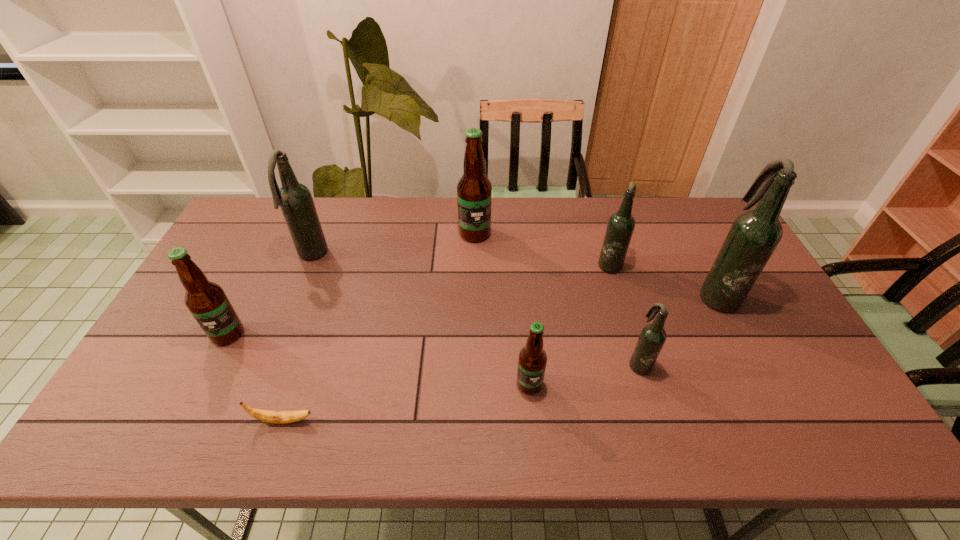
Image resolution: width=960 pixels, height=540 pixels. I want to click on free area in between the second smallest dark beer bottle and the farthest brown beer bottle, so click(x=542, y=248).

Where is `free space that is in between the biggest dark beer bottle and the third beer bottle from left to right`? The width and height of the screenshot is (960, 540). free space that is in between the biggest dark beer bottle and the third beer bottle from left to right is located at coordinates (595, 264).

Where is `free space between the third biggest dark beer bottle and the fifth object from right to left`? free space between the third biggest dark beer bottle and the fifth object from right to left is located at coordinates (542, 248).

You are a GUI agent. You are given a task and a screenshot of the screen. Output one action in this format:
    pyautogui.click(x=<x>, y=<y>)
    Task: Click on the vacant area between the nearest dark beer bottle and the banana
    The image size is (960, 540).
    Given the screenshot: What is the action you would take?
    click(461, 392)

You are a GUI agent. You are given a task and a screenshot of the screen. Output one action in this format:
    pyautogui.click(x=<x>, y=<y>)
    Task: Click on the free space between the rightmost brown beer bottle and the banana
    The image size is (960, 540).
    Given the screenshot: What is the action you would take?
    pyautogui.click(x=406, y=402)

Where is `vacant space that is in between the rightmost brown beer bottle and the third biggest dark beer bottle`? vacant space that is in between the rightmost brown beer bottle and the third biggest dark beer bottle is located at coordinates (569, 323).

This screenshot has width=960, height=540. Identify the location of free space between the rightmost brown beer bottle and the sixth beer bottle from right to left. (420, 320).

Where is `unoccupied area between the fourth farthest object and the smallest dark beer bottle`? unoccupied area between the fourth farthest object and the smallest dark beer bottle is located at coordinates (678, 328).

Find the location of a particular element. The image size is (960, 540). free spot between the leftmost brown beer bottle and the yellow banana is located at coordinates (255, 377).

I want to click on free space between the rightmost brown beer bottle and the leftmost beer bottle, so coord(378,359).